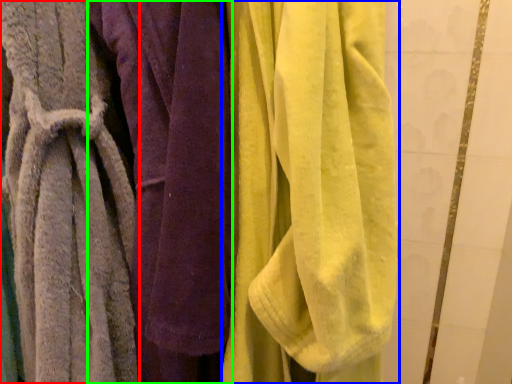
Question: Based on their relative distances, which object is farther from towel (highlighted by a red box)? Choose from towel (highlighted by a blue box) and towel (highlighted by a green box).

Choices:
 (A) towel
 (B) towel

Answer: (A)